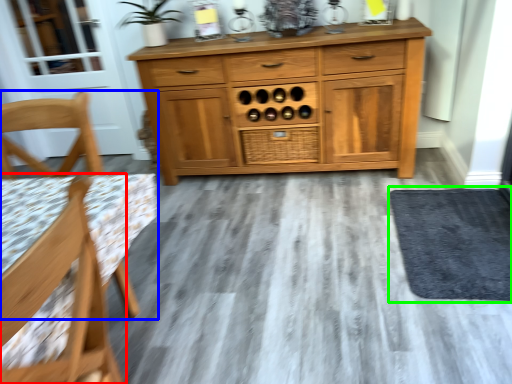
Question: Considering the real-world distances, which object is farthest from chair (highlighted by a red box)? chair (highlighted by a blue box) or door (highlighted by a green box)?

Choices:
 (A) chair
 (B) door

Answer: (B)